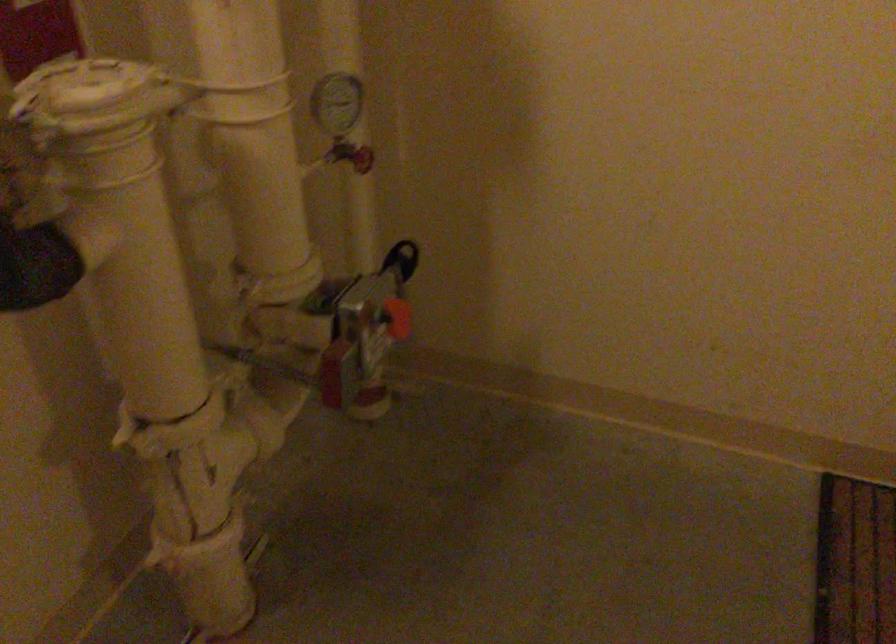
Locate an element on the screen. The image size is (896, 644). red valve lever is located at coordinates (393, 317).